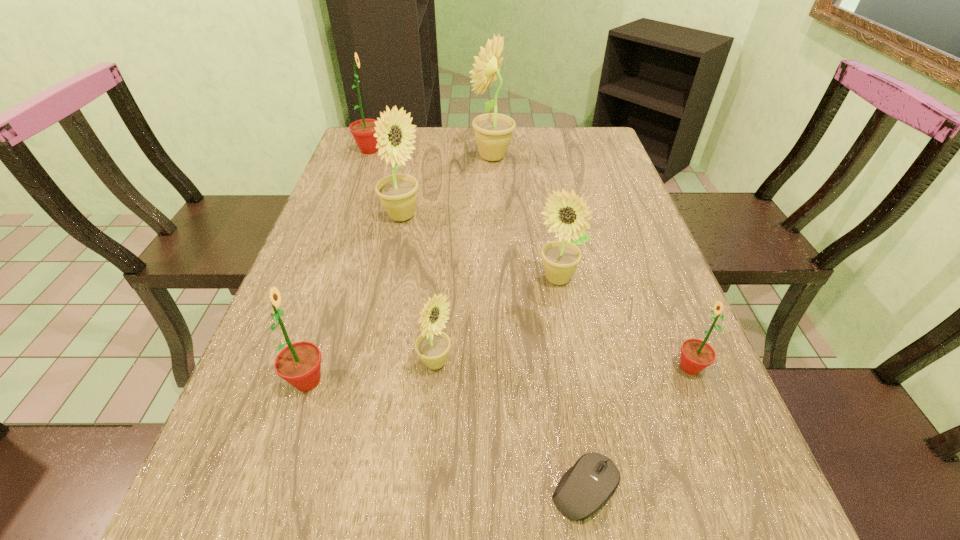
At what (x,y) coordinates should I click in order to perform the action: click on vacant space at the left edge of the desktop. Please return your answer as a coordinate pair (x, y). Looking at the image, I should click on (259, 357).

Identify the location of blank space at the right edge. This screenshot has width=960, height=540. (665, 403).

At what (x,y) coordinates should I click in order to perform the action: click on vacant space at the near right corner. Please return your answer as a coordinate pair (x, y). This screenshot has height=540, width=960. Looking at the image, I should click on (715, 531).

In order to click on free area in between the fourth sunflower from right to left and the shortest object in this screenshot , I will do `click(511, 426)`.

This screenshot has height=540, width=960. I want to click on empty space that is in between the tallest sunflower and the rightmost yellow sunflower, so click(524, 218).

Locate an element on the screen. vacant space in between the shortest object and the nearest yellow sunflower is located at coordinates (511, 426).

Find the location of a particular element. unoccupied position between the rightmost object and the second smallest green sunflower is located at coordinates (499, 374).

At what (x,y) coordinates should I click in order to perform the action: click on vacant point located between the nearest object and the smallest yellow sunflower. Please return your answer as a coordinate pair (x, y). Looking at the image, I should click on (511, 426).

What are the coordinates of `free space between the biggest yellow sunflower and the second farthest yellow sunflower` in the screenshot? It's located at (447, 187).

What are the coordinates of `free area in between the computer equipment and the rightmost green sunflower` in the screenshot? It's located at (637, 428).